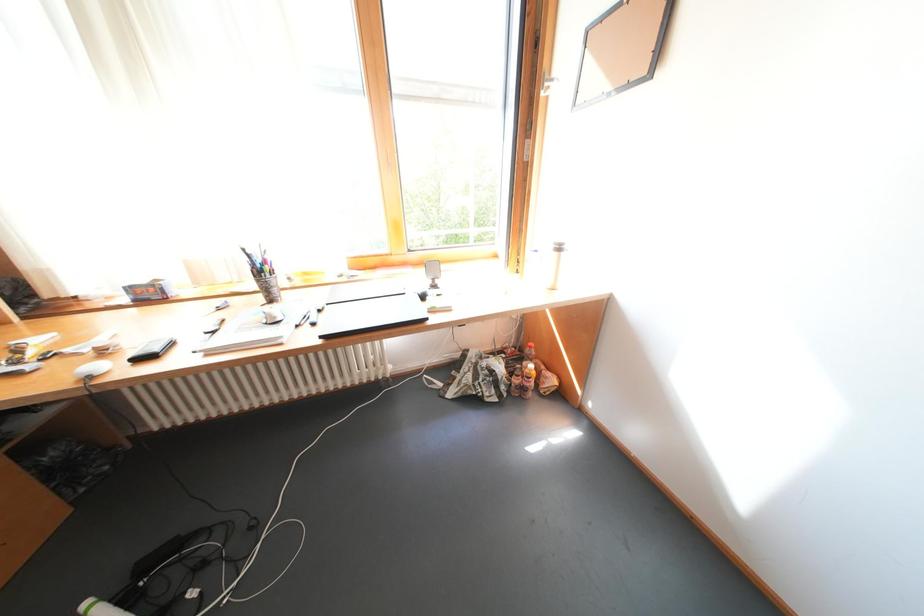
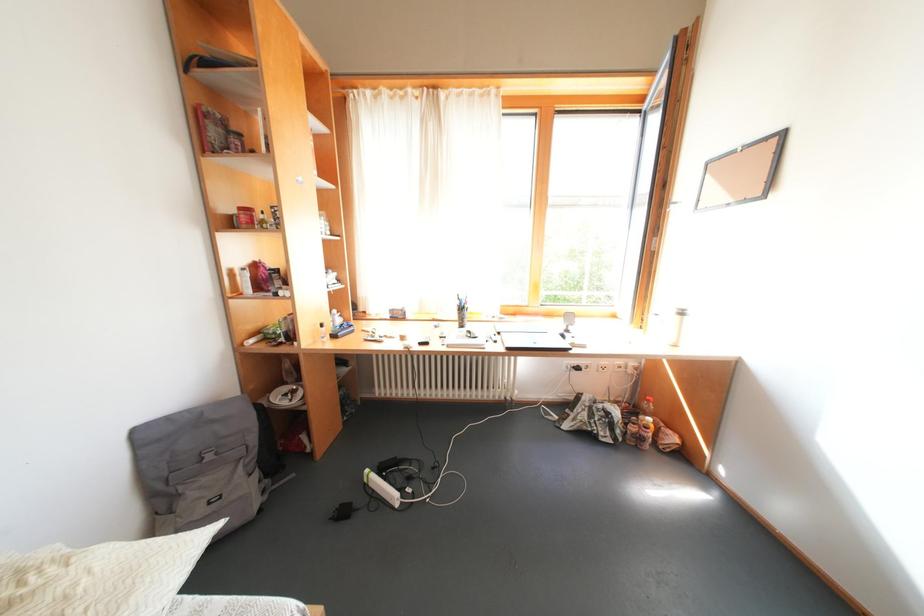
Question: The camera is either moving clockwise (left) or counter-clockwise (right) around the object. The first image is from the beginning of the video and the second image is from the end. Is the camera moving left or right when shooting the video?

Choices:
 (A) Left
 (B) Right

Answer: (B)